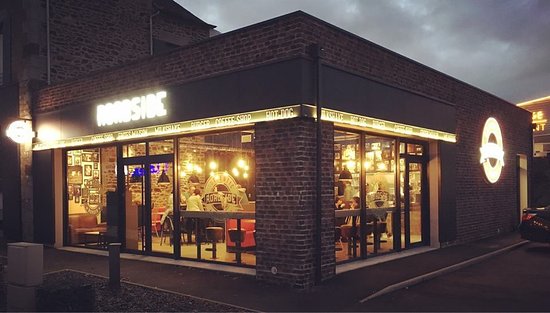
This screenshot has width=550, height=313. I want to click on window, so click(209, 196), click(346, 182), click(382, 176), click(416, 197), click(95, 189), click(133, 195), click(158, 200).